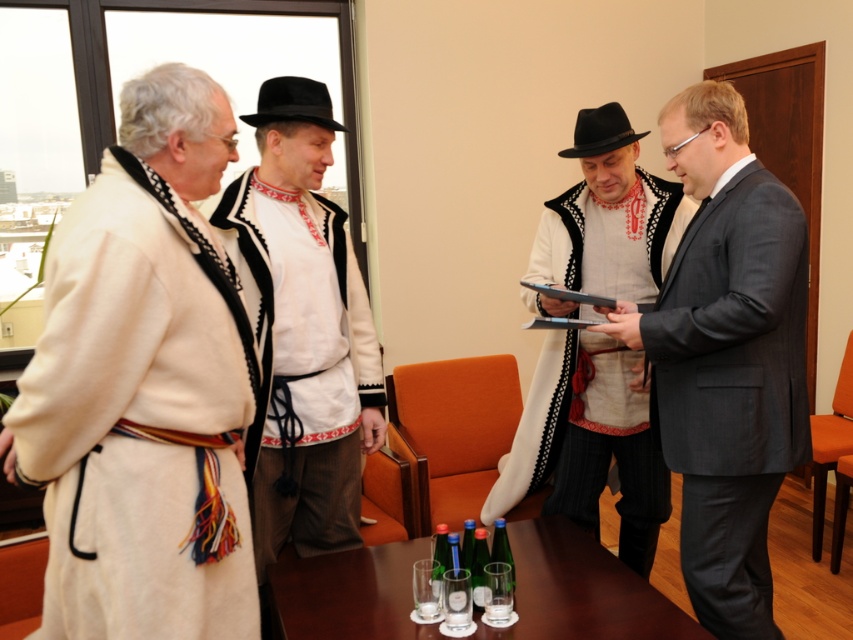
Question: Which point is farther to the camera?

Choices:
 (A) (202, 612)
 (B) (691, 310)
 (C) (410, 568)

Answer: (C)

Question: Is matte black suit at right above matte black vest at center?

Choices:
 (A) yes
 (B) no

Answer: (A)

Question: Among these points, which one is farthest from the camera?

Choices:
 (A) (604, 227)
 (B) (741, 396)
 (C) (413, 560)
 (D) (231, 273)

Answer: (A)

Question: Can you confirm if matte black suit at right is wider than green glass bottles at center?

Choices:
 (A) no
 (B) yes

Answer: (A)

Question: Considering the real-world distances, which object is closest to the green glass bottles at center?

Choices:
 (A) matte black vest at center
 (B) white woolen robe at left
 (C) white embroidered shirt at center

Answer: (C)

Question: Can you confirm if matte black suit at right is bigger than white embroidered shirt at center?

Choices:
 (A) yes
 (B) no

Answer: (A)